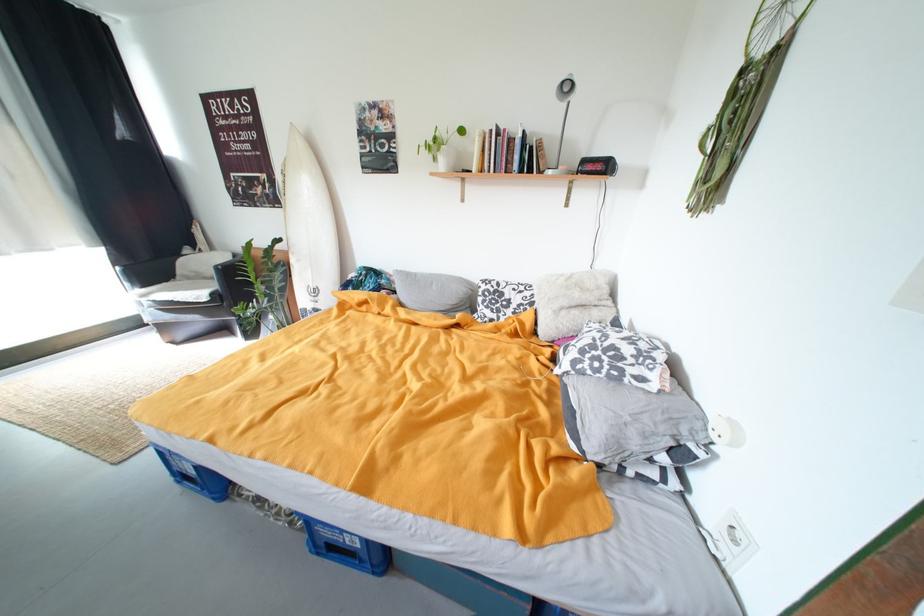
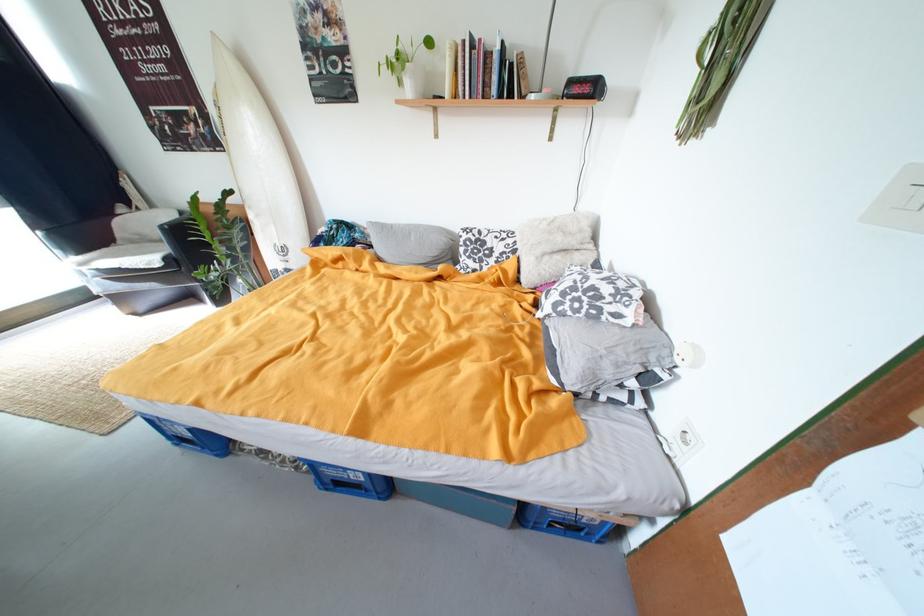
Locate, in the second image, the point that corresponds to [396,282] in the first image.

(371, 235)